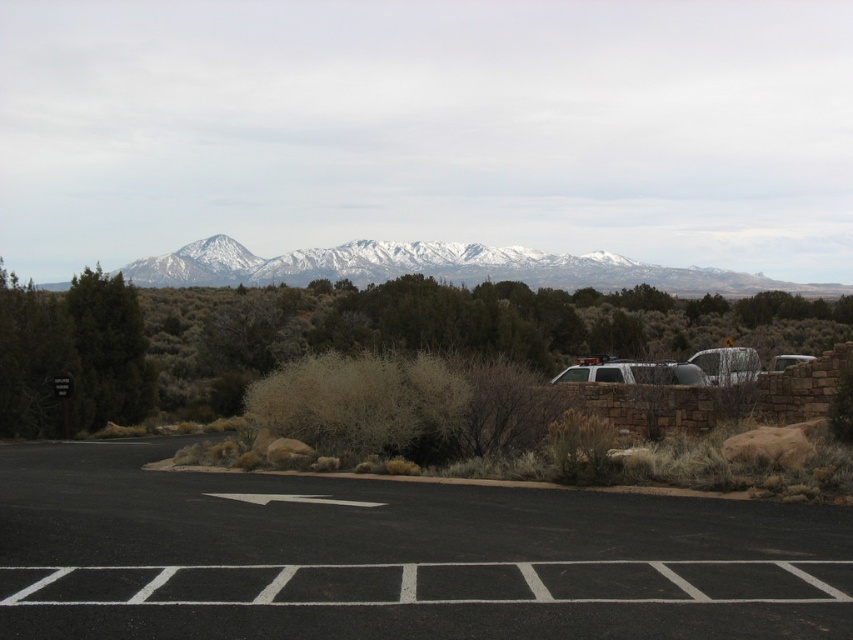
Question: Is green matte tree at left to the right of satin silver suv at center from the viewer's perspective?

Choices:
 (A) no
 (B) yes

Answer: (A)

Question: Is satin silver suv at center further to the viewer compared to silver metallic suv at center-right?

Choices:
 (A) no
 (B) yes

Answer: (B)

Question: Which point is closer to the camera taking this photo?

Choices:
 (A) (570, 260)
 (B) (132, 412)

Answer: (B)

Question: Among these objects, which one is farthest from the camera?

Choices:
 (A) black asphalt parking lot at lower center
 (B) snow-covered mountains at upper center

Answer: (B)

Question: Can you confirm if black asphalt parking lot at lower center is positioned below silver metallic suv at center-right?

Choices:
 (A) yes
 (B) no

Answer: (A)

Question: Which point appears farthest from the camera in this image?

Choices:
 (A) (242, 385)
 (B) (721, 385)
 (C) (786, 356)
 (D) (79, 529)

Answer: (A)